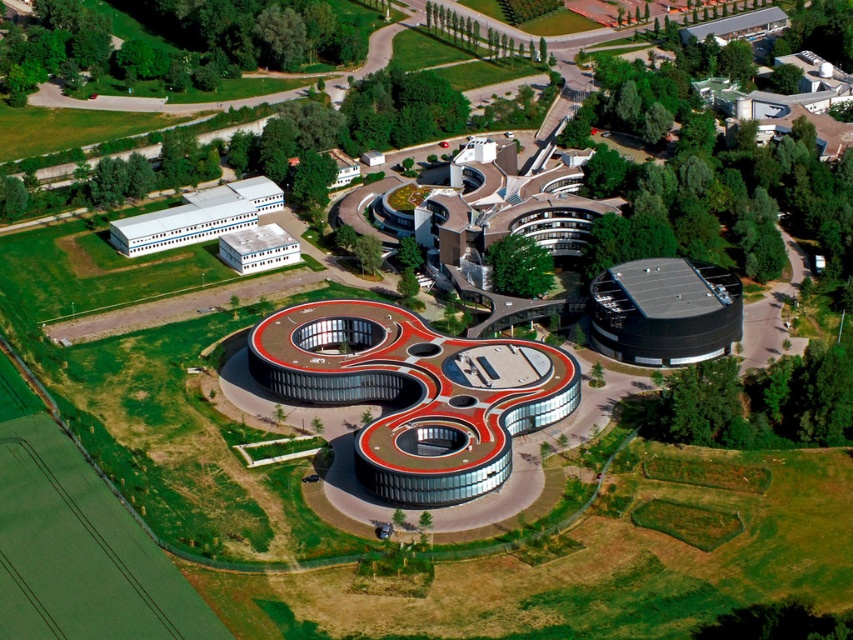
Question: Which point is farther to the camera?

Choices:
 (A) (241, 234)
 (B) (660, 356)

Answer: (A)

Question: Does beige textured building at upper center have a larger size compared to white matte building at upper left?

Choices:
 (A) no
 (B) yes

Answer: (B)

Question: In this image, where is glassy white building at center located relative to white matte building at left?

Choices:
 (A) right
 (B) left

Answer: (A)

Question: Estimate the real-world distances between objects in this image. Which object is farther from the glassy white building at center?

Choices:
 (A) black glass dome at right
 (B) white matte building at left
 (C) beige textured building at upper center

Answer: (B)

Question: Which point is closer to the camera?

Choices:
 (A) white matte building at upper left
 (B) beige textured building at upper center
 (C) glassy white building at center

Answer: (C)

Question: Does beige textured building at upper center have a greater width compared to white matte building at upper left?

Choices:
 (A) yes
 (B) no

Answer: (A)